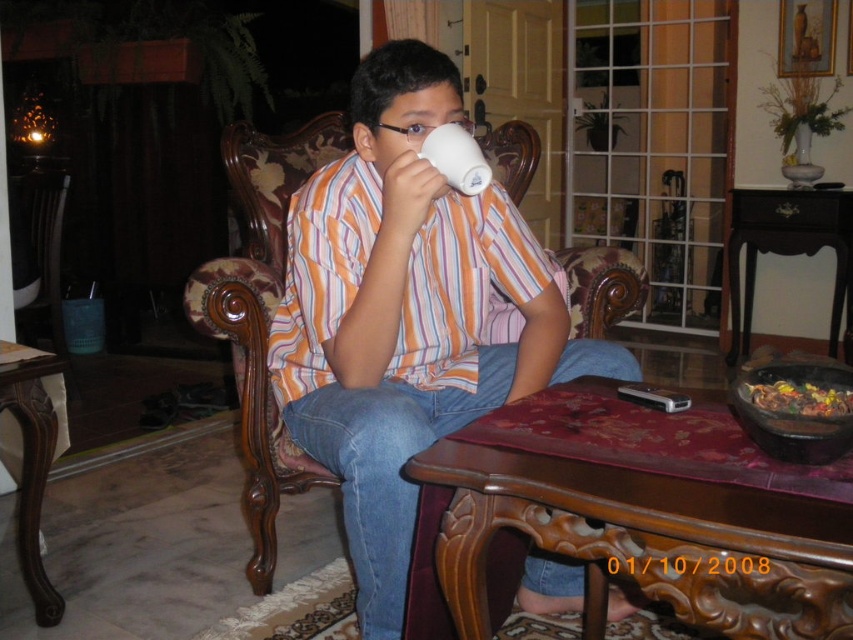
You are a photographer trying to capture the scene from the front. The matte striped shirt at center and the brown polished wood table at lower left are both in your view. Which object will appear bigger in your photo?

The matte striped shirt at center will appear bigger in the photo because it is larger in size than the brown polished wood table at lower left.

You are a guest in this living room and want to place your keys on the nearest surface. You see the brown polished wood table at lower left and the shiny metallic bowl at lower right. Which surface is closer to you?

The brown polished wood table at lower left is closer to you because the shiny metallic bowl at lower right is behind it, meaning the table is in front and nearer to your position.